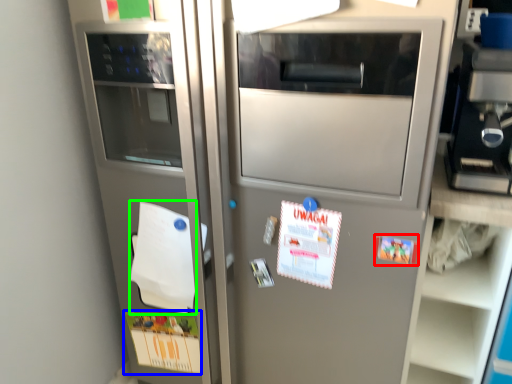
Question: Which object is positioned closest to postcard (highlighted by a red box)? Select from postcard (highlighted by a blue box) and notepad (highlighted by a green box).

Choices:
 (A) postcard
 (B) notepad

Answer: (B)